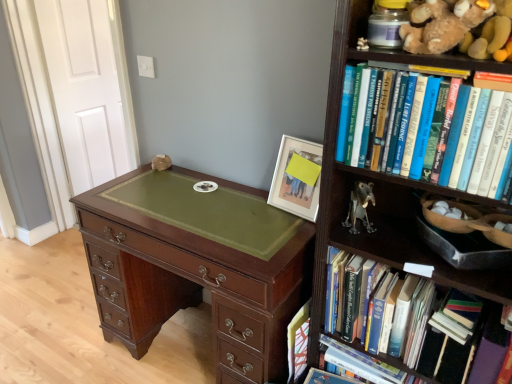
Find the location of a particular element. vacant space to the left of matte wooden picture frame at upper center is located at coordinates (255, 207).